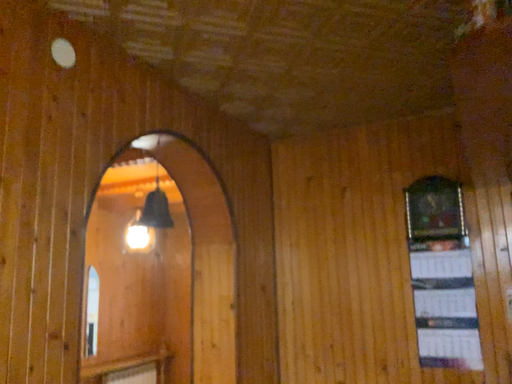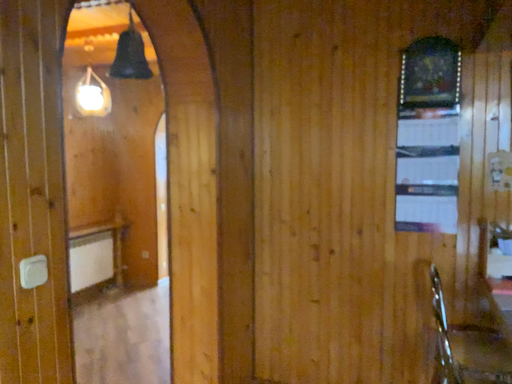
Question: How did the camera likely rotate when shooting the video?

Choices:
 (A) rotated left
 (B) rotated right

Answer: (B)